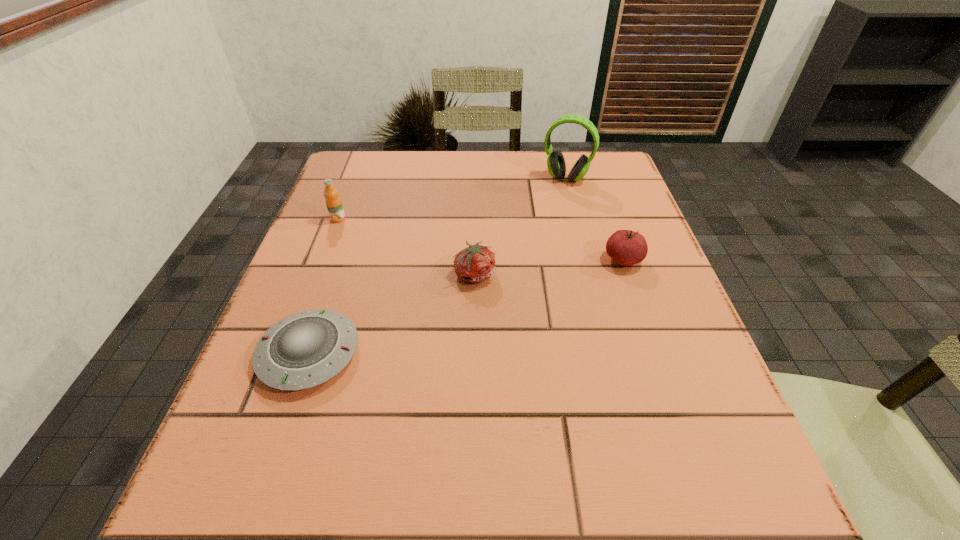
This screenshot has height=540, width=960. In order to click on free spot that satisfies the following two spatial constraints: 1. on the label of the second farthest object; 2. on the left side of the left tomato in this screenshot , I will do `click(317, 274)`.